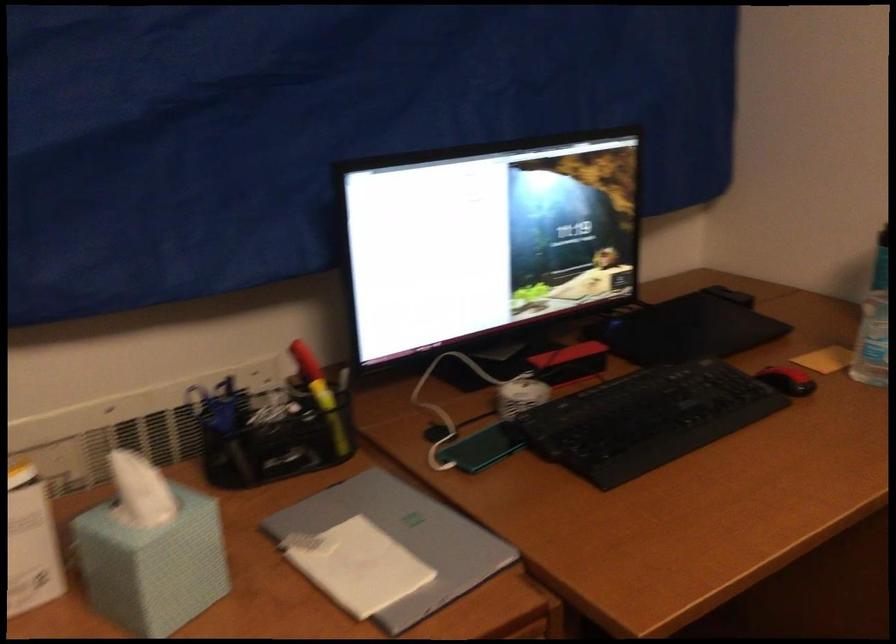
Describe the element at coordinates (871, 336) in the screenshot. I see `the bottle cap` at that location.